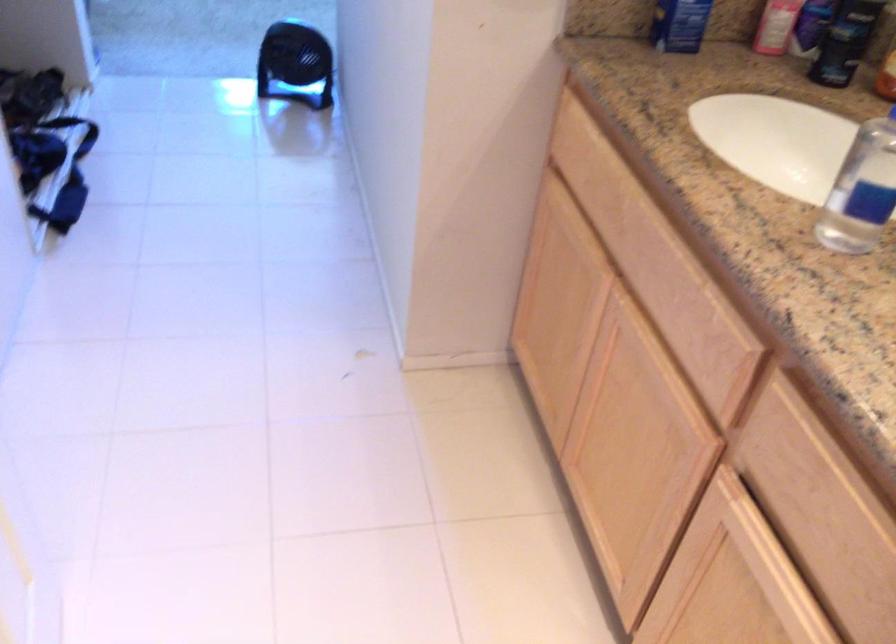
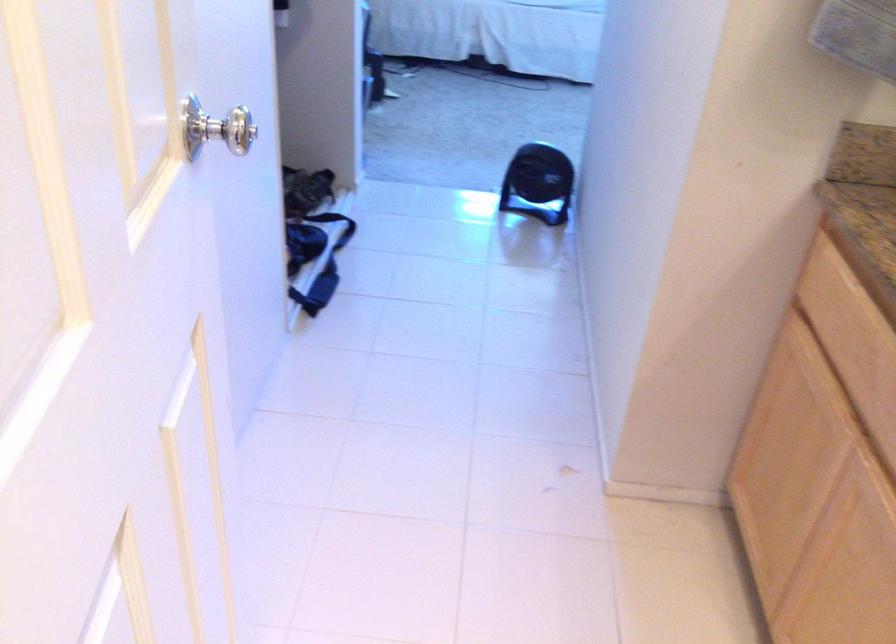
Question: The first image is from the beginning of the video and the second image is from the end. How did the camera likely rotate when shooting the video?

Choices:
 (A) Left
 (B) Right
 (C) Up
 (D) Down

Answer: (A)